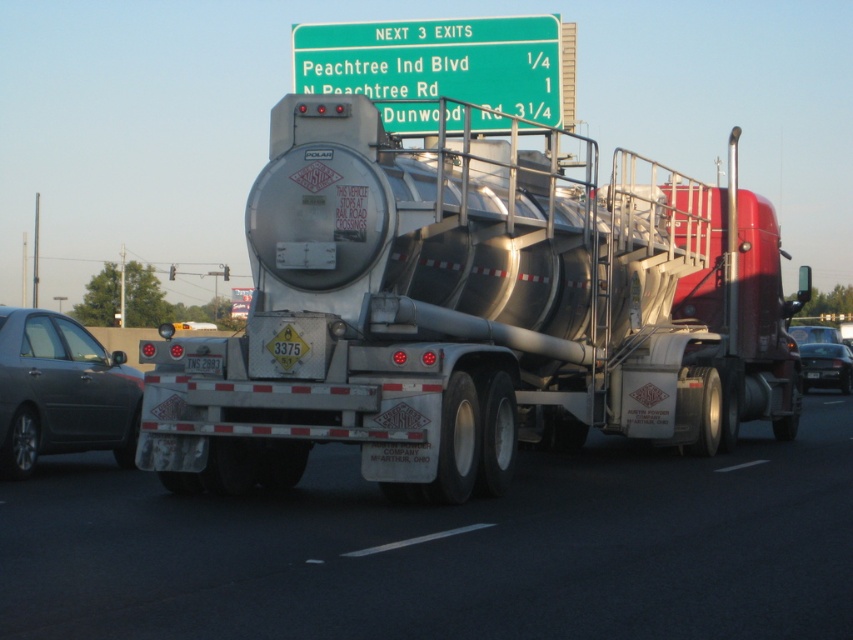
This screenshot has width=853, height=640. I want to click on brushed metal tanker at center, so click(474, 310).

Is point (581, 316) positioned in front of point (805, 372)?

Yes, it is.

Is point (534, 337) more distant than point (807, 376)?

No, (534, 337) is closer to viewer.

At what (x,y) coordinates should I click in order to perform the action: click on brushed metal tanker at center. Please return your answer as a coordinate pair (x, y). Looking at the image, I should click on (474, 310).

Looking at this image, does green plastic sign at upper center appear on the left side of black plastic license plate at rear?

Indeed, green plastic sign at upper center is positioned on the left side of black plastic license plate at rear.

Which is behind, point (322, 22) or point (817, 372)?

Positioned behind is point (322, 22).

This screenshot has height=640, width=853. Identify the location of green plastic sign at upper center. (444, 61).

Is silver metallic tanker truck at center to the right of white plastic license plate at rear from the viewer's perspective?

Correct, you'll find silver metallic tanker truck at center to the right of white plastic license plate at rear.

Is silver metallic tanker truck at center closer to the viewer compared to white plastic license plate at rear?

Yes.

Is point (825, 548) in front of point (209, 371)?

Yes, it is.

The width and height of the screenshot is (853, 640). I want to click on silver metallic tanker truck at center, so click(450, 548).